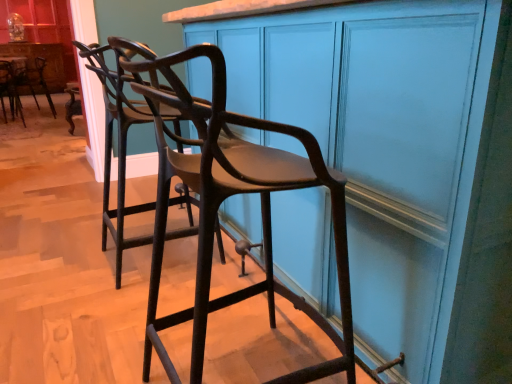
Question: Considering the positions of matte black bar stool at left, acting as the first chair starting from the back, and matte brown wood chair at center, marked as the third chair in a top-to-bottom arrangement, in the image, is matte black bar stool at left, acting as the first chair starting from the back, wider or thinner than matte brown wood chair at center, marked as the third chair in a top-to-bottom arrangement,?

Choices:
 (A) thin
 (B) wide

Answer: (B)

Question: Is point (24, 74) positioned closer to the camera than point (199, 355)?

Choices:
 (A) closer
 (B) farther

Answer: (B)

Question: Based on their relative distances, which object is farther from the matte blue cabinet at upper left, positioned as the 2th cabinetry in right-to-left order?

Choices:
 (A) matte wood cabinet at center, which is the 1th cabinetry in front-to-back order
 (B) matte brown wood chair at center, marked as the third chair in a top-to-bottom arrangement
 (C) matte black bar stool at left, which is counted as the 2th chair, starting from the top
 (D) matte black bar stool at left, which ranks as the 3th chair in front-to-back order

Answer: (A)

Question: Considering the real-world distances, which object is farthest from the matte black bar stool at left, which is the 1th chair from top to bottom?

Choices:
 (A) matte wood cabinet at center, which is the 1th cabinetry in front-to-back order
 (B) matte blue cabinet at upper left, the first cabinetry when ordered from left to right
 (C) matte brown wood chair at center, marked as the third chair in a top-to-bottom arrangement
 (D) matte black bar stool at left, which appears as the 2th chair when ordered from the bottom

Answer: (A)